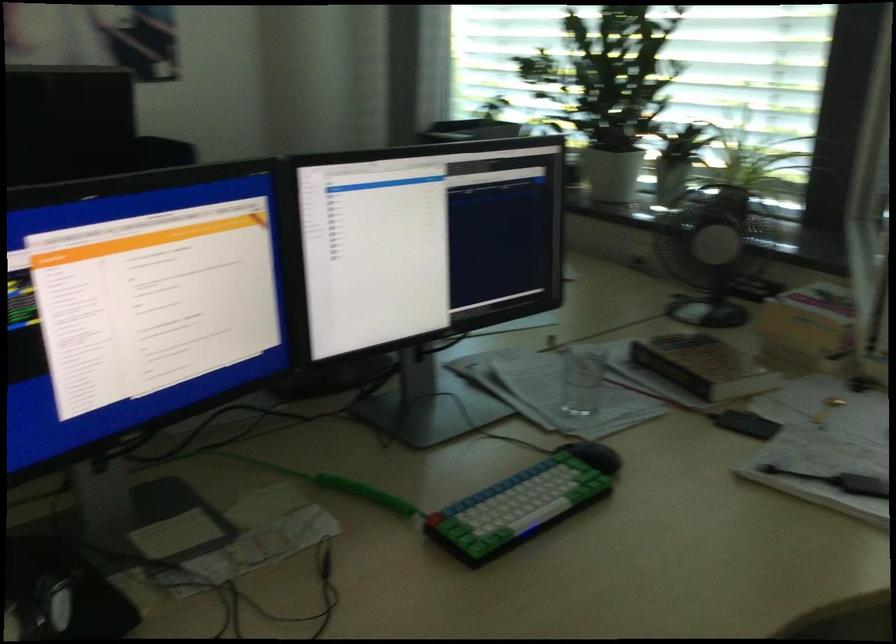
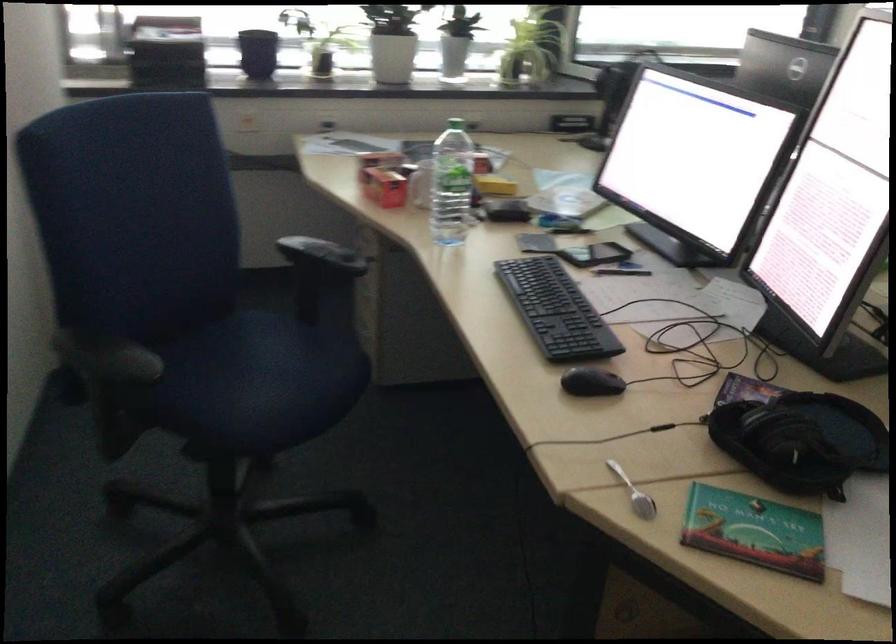
Find the pixel in the second image that matches (x=634, y=182) in the first image.

(392, 58)